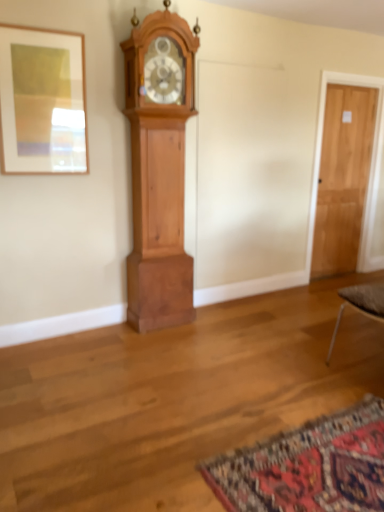
Question: Does cherry wood grandfather clock at left appear on the left side of matte wood picture frame at upper left?

Choices:
 (A) yes
 (B) no

Answer: (B)

Question: Is cherry wood grandfather clock at left oriented away from matte wood picture frame at upper left?

Choices:
 (A) no
 (B) yes

Answer: (A)

Question: Is cherry wood grandfather clock at left next to matte wood picture frame at upper left?

Choices:
 (A) yes
 (B) no

Answer: (B)

Question: Is cherry wood grandfather clock at left thinner than matte wood picture frame at upper left?

Choices:
 (A) no
 (B) yes

Answer: (A)

Question: Is cherry wood grandfather clock at left facing towards matte wood picture frame at upper left?

Choices:
 (A) yes
 (B) no

Answer: (B)

Question: Is light brown wooden door at right inside or outside of matte wood picture frame at upper left?

Choices:
 (A) inside
 (B) outside

Answer: (B)

Question: From a real-world perspective, is light brown wooden door at right above or below matte wood picture frame at upper left?

Choices:
 (A) below
 (B) above

Answer: (A)

Question: Looking at their shapes, would you say light brown wooden door at right is wider or thinner than matte wood picture frame at upper left?

Choices:
 (A) thin
 (B) wide

Answer: (B)

Question: Is point click(329, 103) closer or farther from the camera than point click(41, 134)?

Choices:
 (A) farther
 (B) closer

Answer: (A)

Question: From a real-world perspective, is carpeted mat at lower right above or below matte wood picture frame at upper left?

Choices:
 (A) below
 (B) above

Answer: (A)

Question: Considering their positions, is carpeted mat at lower right located in front of or behind matte wood picture frame at upper left?

Choices:
 (A) behind
 (B) front

Answer: (B)

Question: From the image's perspective, is carpeted mat at lower right above or below matte wood picture frame at upper left?

Choices:
 (A) below
 (B) above

Answer: (A)

Question: Based on their sizes in the image, would you say carpeted mat at lower right is bigger or smaller than matte wood picture frame at upper left?

Choices:
 (A) big
 (B) small

Answer: (A)

Question: From a real-world perspective, is cherry wood grandfather clock at left positioned above or below matte wood picture frame at upper left?

Choices:
 (A) above
 (B) below

Answer: (B)

Question: Relative to matte wood picture frame at upper left, is cherry wood grandfather clock at left in front or behind?

Choices:
 (A) front
 (B) behind

Answer: (B)